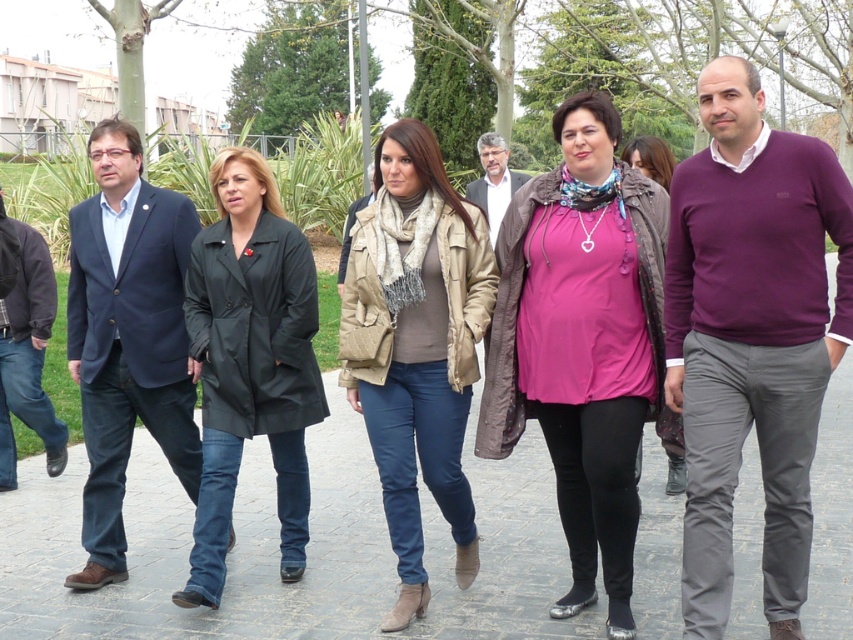
You are standing on the gray concrete pavement at center. There is a point at coordinates (306, 548). Is this point on the same surface you are standing on?

Yes, the point at coordinates (306, 548) is on the gray concrete pavement at center, so it is on the same surface you are standing on.

Consider the image. You are a photographer standing in the park. You want to take a photo of the gray concrete pavement at center and the purple sweater at center. Which object should you focus on first to ensure both are in focus?

The gray concrete pavement at center should be focused on first because the purple sweater at center is behind it, so focusing on the closer object first will help ensure both are in focus.

You are a photographer trying to capture a group photo of the pink matte shirt at center and the dark blue suit at left. Which of the two requires a wider angle to fully capture in the frame?

The dark blue suit at left requires a wider angle because it occupies more space than the pink matte shirt at center.